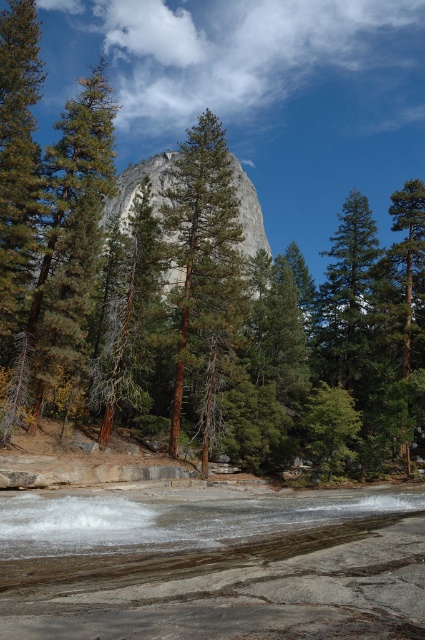
You are an explorer who wants to take a photo of the gray granite mountain at center. However, the green textured tree at center is blocking your view. Can you determine if the tree is taller than the mountain?

The green textured tree at center has a greater height compared to the gray granite mountain at center, so the tree is taller and blocking the view of the gray granite mountain at center.

You are standing at the edge of the river and see the clear water at lower center and the green matte tree at center. Which object is closer to you?

The clear water at lower center is closer to you because it is in front of the green matte tree at center.

From the picture: You are a hiker standing at the edge of the river looking towards the center of the image. You see the green textured tree at center and the gray granite mountain at center. Which object is positioned higher in the scene?

The green textured tree at center is positioned higher than the gray granite mountain at center in the scene.